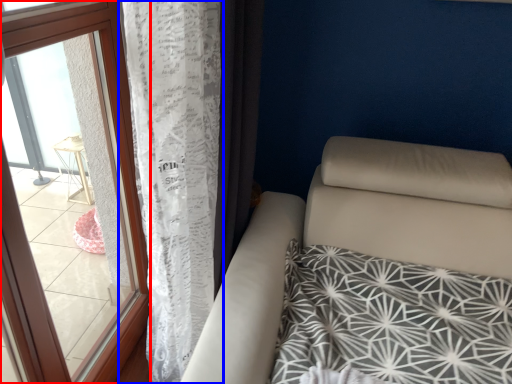
Question: Which object is further to the camera taking this photo, window (highlighted by a red box) or curtain (highlighted by a blue box)?

Choices:
 (A) window
 (B) curtain

Answer: (B)